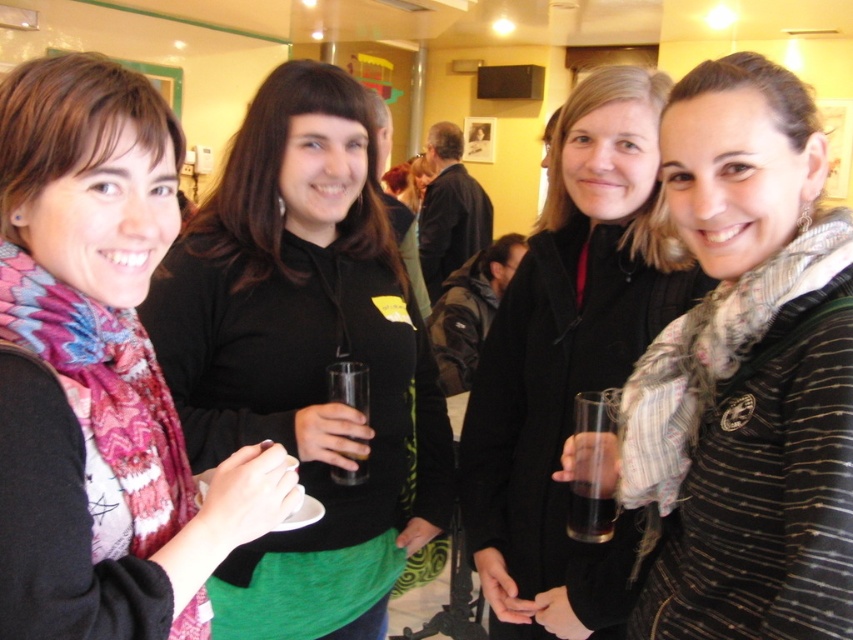
Question: Can you confirm if matte black coat at center is wider than translucent glass at lower right?

Choices:
 (A) no
 (B) yes

Answer: (B)

Question: Which of these objects is positioned farthest from the matte scarf at left?

Choices:
 (A) matte black coat at center
 (B) translucent glass at lower right
 (C) matte black hoodie at center

Answer: (A)

Question: Can you confirm if matte black hoodie at center is bigger than matte black coat at center?

Choices:
 (A) no
 (B) yes

Answer: (B)

Question: Can you confirm if striped knit sweater at center is positioned below matte black coat at center?

Choices:
 (A) no
 (B) yes

Answer: (A)

Question: Which of these objects is positioned farthest from the matte black hoodie at center?

Choices:
 (A) translucent glass at lower right
 (B) matte black coat at center
 (C) matte scarf at left
 (D) striped knit sweater at center

Answer: (D)

Question: Among these objects, which one is farthest from the camera?

Choices:
 (A) striped knit sweater at center
 (B) translucent glass at lower right

Answer: (B)